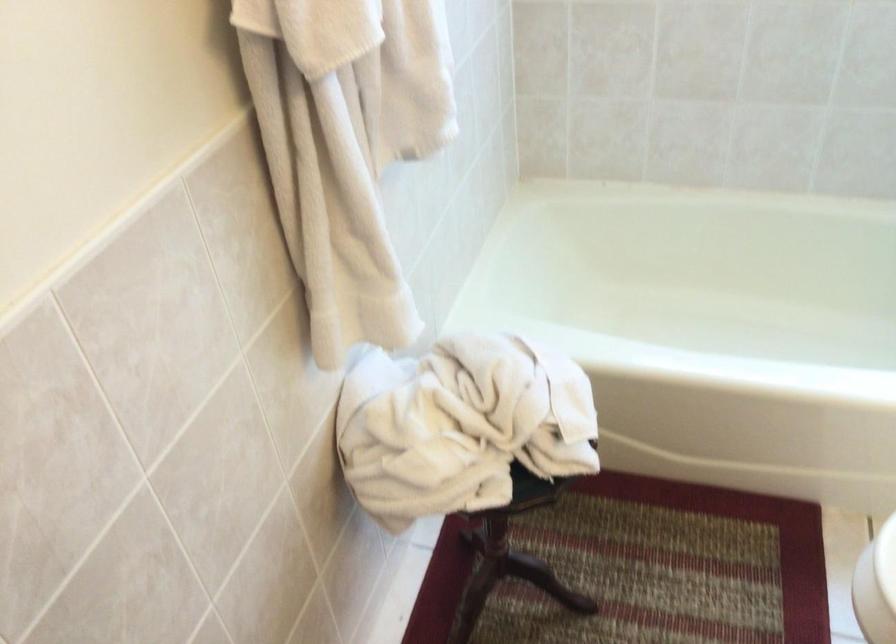
At what (x,y) coordinates should I click in order to perform the action: click on small wooden stool. Please return your answer as a coordinate pair (x, y). Looking at the image, I should click on (440, 431).